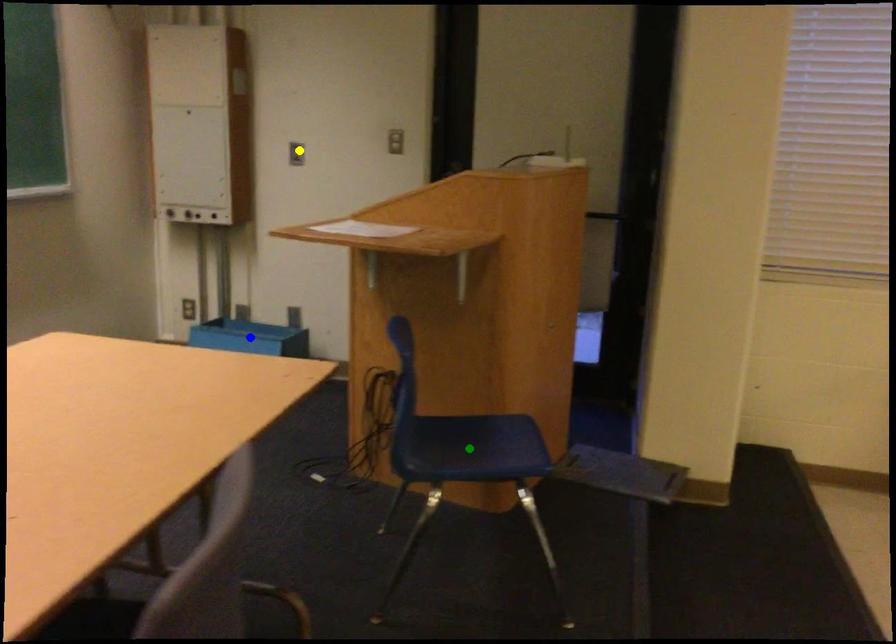
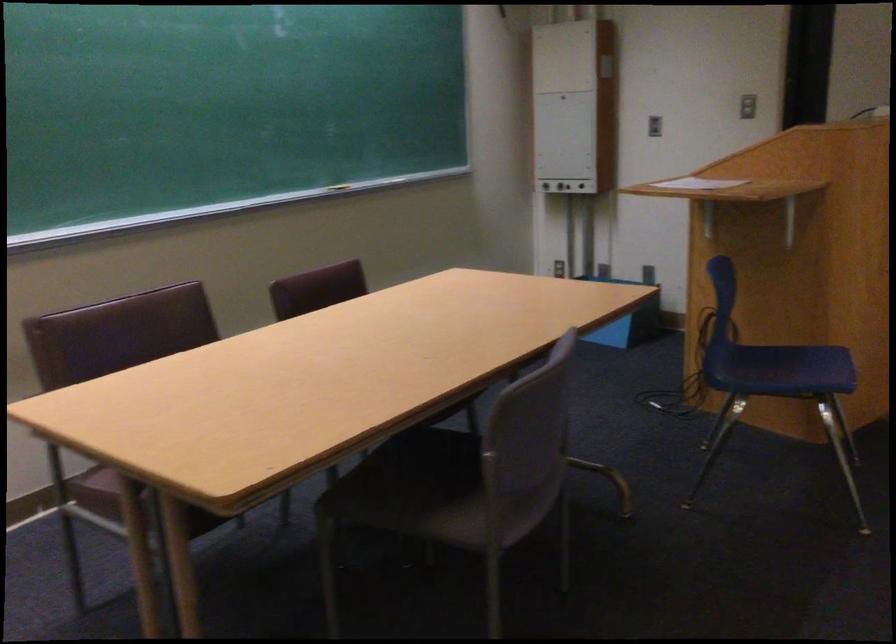
I am providing you with two images of the same scene from different viewpoints. Three points are marked in image1. Which point corresponds to a part or object that is occluded in image2?In image1, three points are marked. Which of them correspond to a part or object that is occluded in image2?Among the three points shown in image1, which one corresponds to a part or object that is no longer visible due to occlusion in image2?

Invisible in image2: blue point.